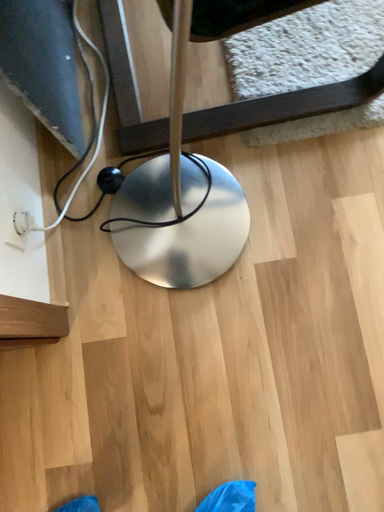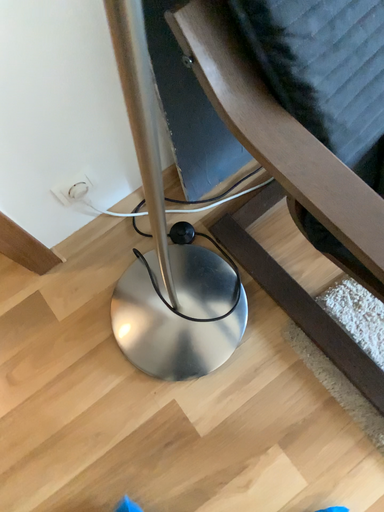
Question: Which way did the camera rotate in the video?

Choices:
 (A) rotated downward
 (B) rotated upward

Answer: (B)